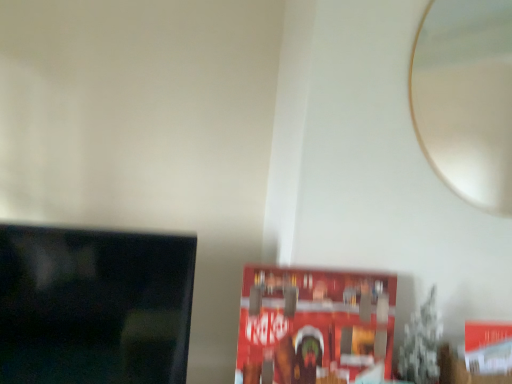
Question: Is point (463, 18) closer or farther from the camera than point (142, 274)?

Choices:
 (A) farther
 (B) closer

Answer: (A)

Question: Considering the relative positions of white glossy mirror at upper right and black glossy tv at left in the image provided, is white glossy mirror at upper right to the left or to the right of black glossy tv at left?

Choices:
 (A) right
 (B) left

Answer: (A)

Question: Which is farther from the red matte paperback book at center?

Choices:
 (A) white glossy mirror at upper right
 (B) black glossy tv at left

Answer: (A)

Question: Considering the real-world distances, which object is farthest from the red matte paperback book at center?

Choices:
 (A) black glossy tv at left
 (B) white glossy mirror at upper right

Answer: (B)